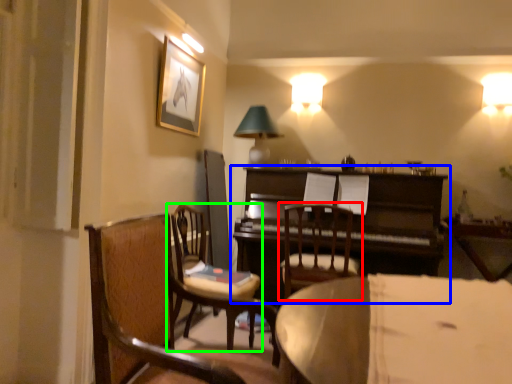
Question: Based on their relative distances, which object is farther from chair (highlighted by a red box)? Choose from piano (highlighted by a blue box) and chair (highlighted by a green box).

Choices:
 (A) piano
 (B) chair

Answer: (B)